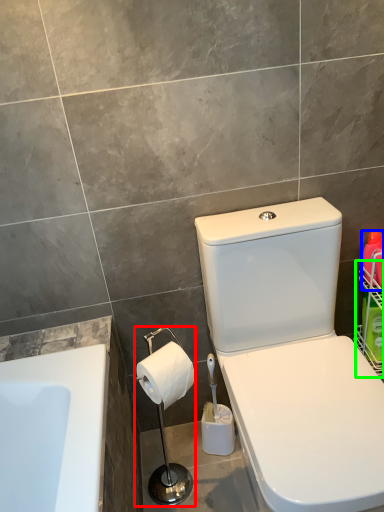
Question: Based on their relative distances, which object is farther from shower (highlighted by a red box)? Choose from cleaning product (highlighted by a blue box) and basket (highlighted by a green box).

Choices:
 (A) cleaning product
 (B) basket

Answer: (A)